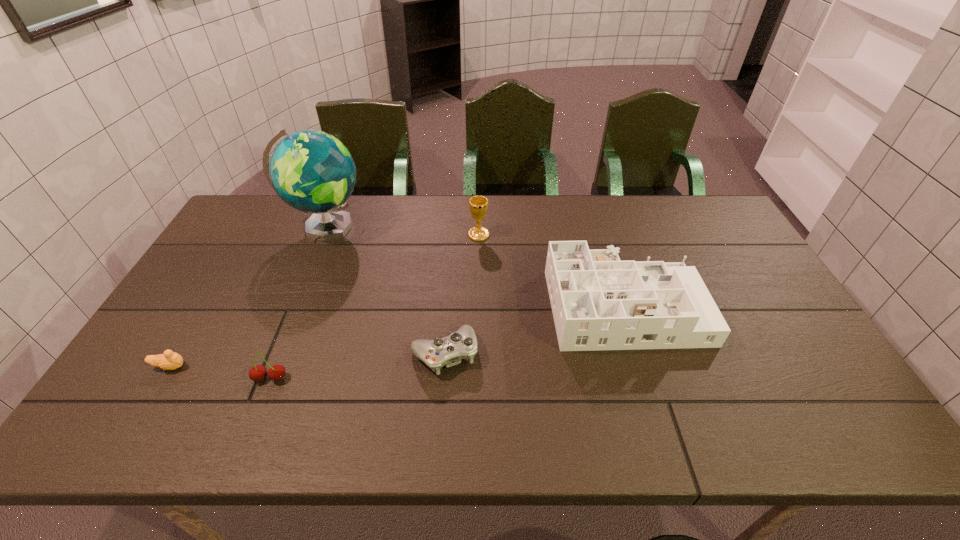
Locate an element on the screen. free space at the near left corner is located at coordinates (140, 435).

Identify the location of vacant space at the far right corner of the desktop. (708, 234).

Image resolution: width=960 pixels, height=540 pixels. Identify the location of vacant space in between the control and the leftmost object. (307, 360).

You are a GUI agent. You are given a task and a screenshot of the screen. Output one action in this format:
    pyautogui.click(x=<x>, y=<y>)
    Task: Click on the vacant space that is in between the cherry and the duckling
    
    Given the screenshot: What is the action you would take?
    pyautogui.click(x=220, y=372)

Find the location of a particular element. vacant area between the leftmost object and the third shortest object is located at coordinates (220, 372).

The height and width of the screenshot is (540, 960). I want to click on vacant point located between the globe and the control, so click(x=385, y=290).

Identify the location of vacant space that's between the cherry and the chalice. click(x=374, y=306).

At what (x,y) coordinates should I click in order to perform the action: click on free space between the tallest object and the control. Please return your answer as a coordinate pair (x, y). This screenshot has height=540, width=960. Looking at the image, I should click on (385, 290).

Where is `free area in between the fourth tallest object and the control`? The height and width of the screenshot is (540, 960). free area in between the fourth tallest object and the control is located at coordinates (357, 366).

Locate an element on the screen. The width and height of the screenshot is (960, 540). empty space that is in between the leftmost object and the chalice is located at coordinates (324, 301).